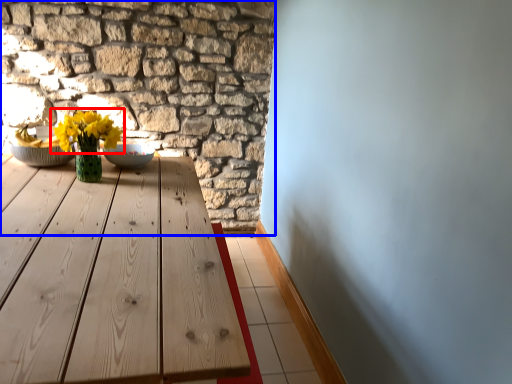
Question: Which point is closer to the camera, flower (highlighted by a red box) or brickwork (highlighted by a blue box)?

Choices:
 (A) flower
 (B) brickwork

Answer: (A)